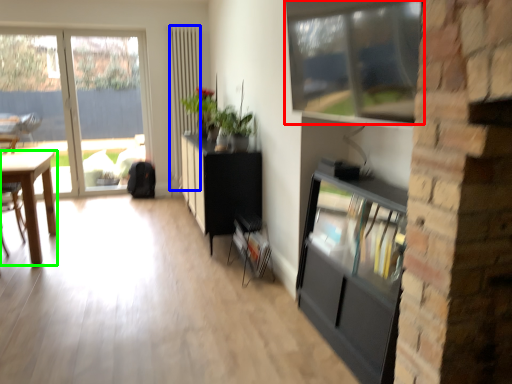
Question: Estimate the real-world distances between objects in this image. Which object is farther from window (highlighted by a red box), screen door (highlighted by a blue box) or desk (highlighted by a green box)?

Choices:
 (A) screen door
 (B) desk

Answer: (A)